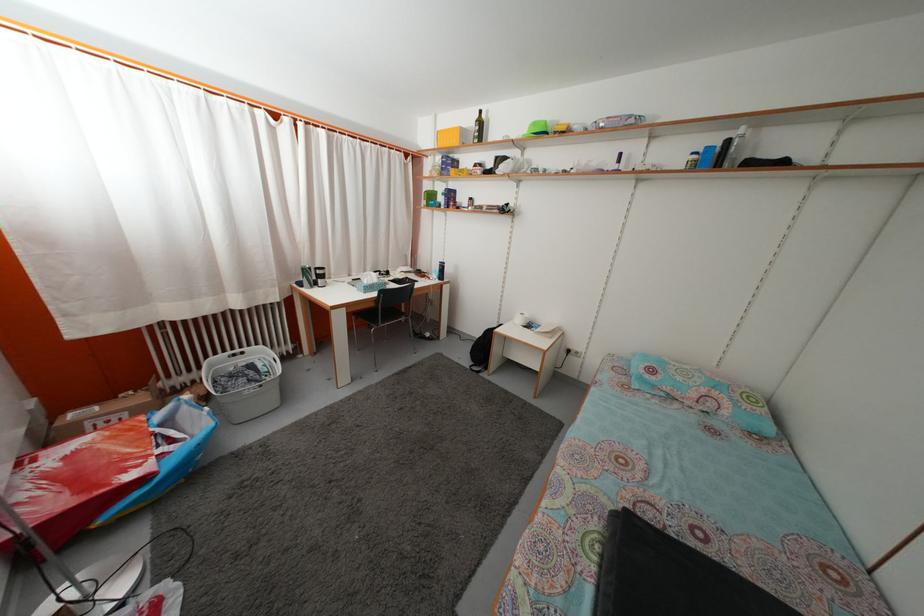
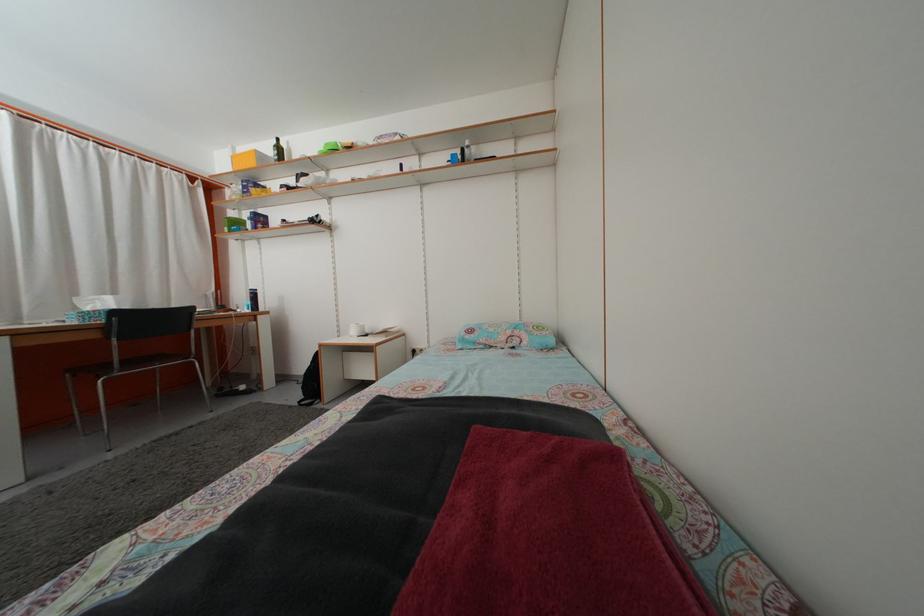
Where in the second image is the point corresponding to (432,193) from the first image?

(237, 223)